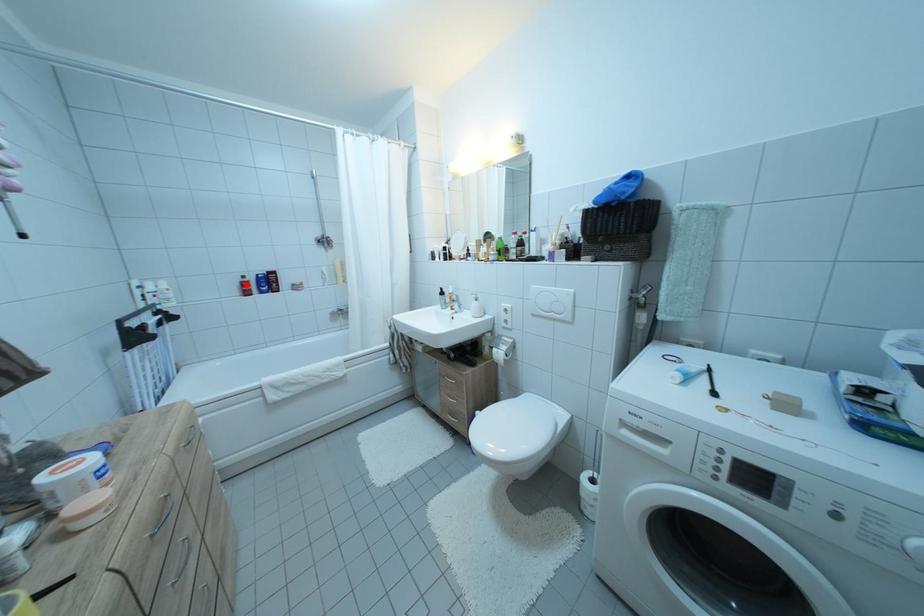
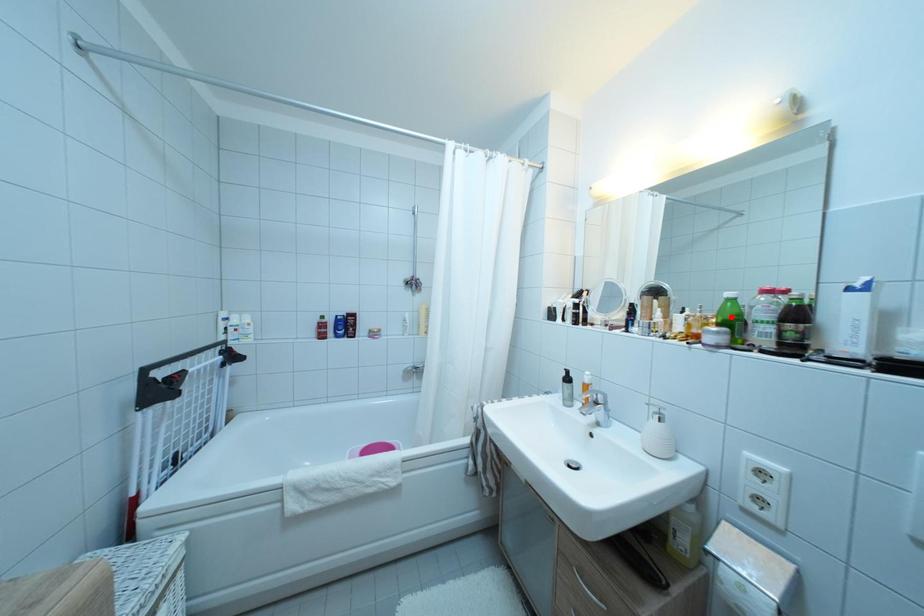
I am providing you with two images of the same scene from different viewpoints. A red point is marked on the first image and another point is marked on the second image. Is the marked point in image1 the same physical position as the marked point in image2?

No